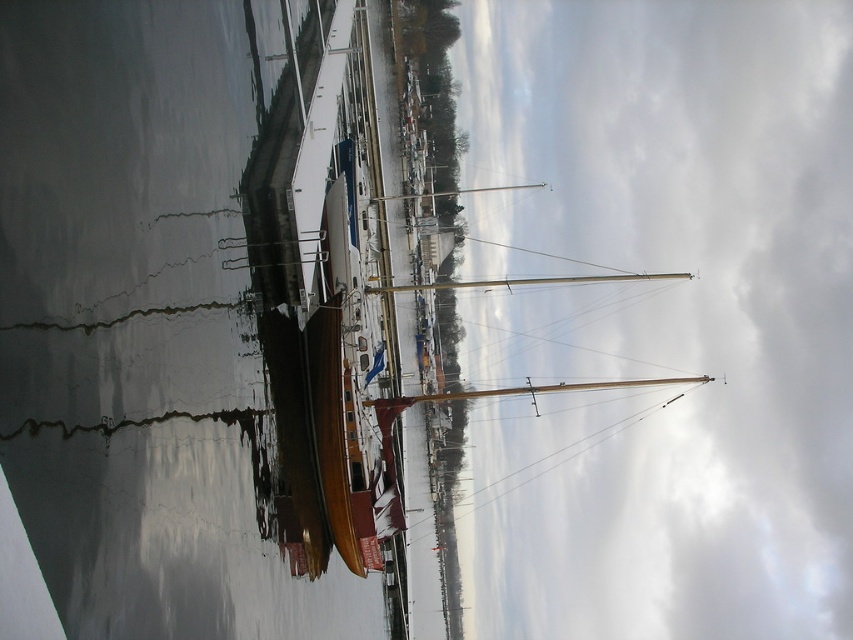
Does point (318, 596) lie in front of point (486, 188)?

Yes, it is in front of point (486, 188).

Can you confirm if glossy water at lower left is taller than polished wood mast at center?

Indeed, glossy water at lower left has a greater height compared to polished wood mast at center.

The image size is (853, 640). Identify the location of glossy water at lower left. (149, 323).

Find the location of a particular element. glossy water at lower left is located at coordinates coord(149,323).

Between white cloudy sky at upper center and polished wood mast at center, which one has more height?

white cloudy sky at upper center is taller.

Does white cloudy sky at upper center appear over polished wood mast at center?

No.

Where is `white cloudy sky at upper center`? Image resolution: width=853 pixels, height=640 pixels. white cloudy sky at upper center is located at coordinates (660, 317).

Where is `white cloudy sky at upper center`? white cloudy sky at upper center is located at coordinates (660, 317).